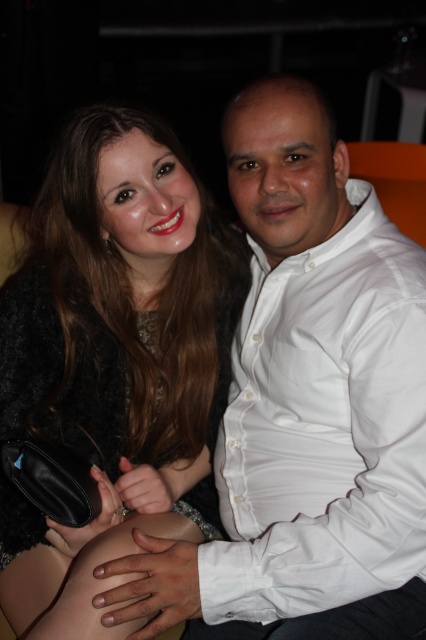
You are a photographer setting up a photo shoot. You need to place a spotlight on the shiny black dress at center and the white cotton shirt at right. Since the dress is darker, you want to ensure it gets enough light. Based on their positions, which object is closer to the left side of the scene?

The shiny black dress at center is positioned on the left side of white cotton shirt at right, so the dress is closer to the left side of the scene.

You are a photographer standing 3 feet away from the shiny black dress at center. Can you take a clear photo of it without moving closer?

The shiny black dress at center is 33.61 inches away from the viewer. Since 33.61 inches is approximately 2.8 feet, you are already within the required distance to take a clear photo without needing to move closer.